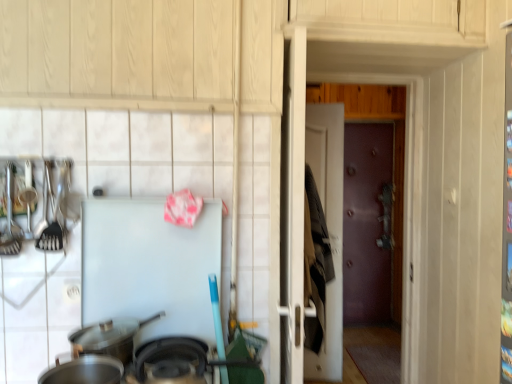
Question: Can brown leather door at center, the second door when ordered from right to left, be found inside metallic purple door at right, which ranks as the 1th door in back-to-front order?

Choices:
 (A) yes
 (B) no

Answer: (B)

Question: Could you tell me if metallic purple door at right, the second door viewed from the left, is facing brown leather door at center, which is the first door from front to back?

Choices:
 (A) yes
 (B) no

Answer: (B)

Question: Can you confirm if metallic purple door at right, the second door viewed from the left, is taller than brown leather door at center, the second door when ordered from right to left?

Choices:
 (A) yes
 (B) no

Answer: (A)

Question: Is metallic purple door at right, which ranks as the 1th door in back-to-front order, to the right of brown leather door at center, which is the first door from front to back, from the viewer's perspective?

Choices:
 (A) yes
 (B) no

Answer: (A)

Question: Can you confirm if metallic purple door at right, acting as the first door starting from the right, is bigger than brown leather door at center, the second door when ordered from right to left?

Choices:
 (A) yes
 (B) no

Answer: (B)

Question: Is metallic purple door at right, acting as the first door starting from the right, wider than brown leather door at center, the second door when ordered from right to left?

Choices:
 (A) no
 (B) yes

Answer: (A)

Question: Can you confirm if black matte wok at lower center, which appears as the second wok when viewed from the back, is positioned to the left of shiny metallic spoon at left?

Choices:
 (A) yes
 (B) no

Answer: (B)

Question: Can you confirm if black matte wok at lower center, which appears as the second wok when viewed from the back, is wider than shiny metallic spoon at left?

Choices:
 (A) no
 (B) yes

Answer: (B)

Question: Considering the relative sizes of black matte wok at lower center, which is counted as the 2th wok, starting from the front, and shiny metallic spoon at left in the image provided, is black matte wok at lower center, which is counted as the 2th wok, starting from the front, taller than shiny metallic spoon at left?

Choices:
 (A) no
 (B) yes

Answer: (A)

Question: Is black matte wok at lower center, which appears as the second wok when viewed from the back, not inside shiny metallic spoon at left?

Choices:
 (A) no
 (B) yes

Answer: (B)

Question: Is black matte wok at lower center, which is counted as the 2th wok, starting from the front, smaller than shiny metallic spoon at left?

Choices:
 (A) yes
 (B) no

Answer: (B)

Question: Considering the relative sizes of black matte wok at lower center, which is counted as the 2th wok, starting from the front, and shiny metallic spoon at left in the image provided, is black matte wok at lower center, which is counted as the 2th wok, starting from the front, shorter than shiny metallic spoon at left?

Choices:
 (A) no
 (B) yes

Answer: (B)

Question: From the image's perspective, is brown leather door at center, acting as the 1th door starting from the left, under black matte wok at lower center, which appears as the second wok when viewed from the back?

Choices:
 (A) no
 (B) yes

Answer: (B)